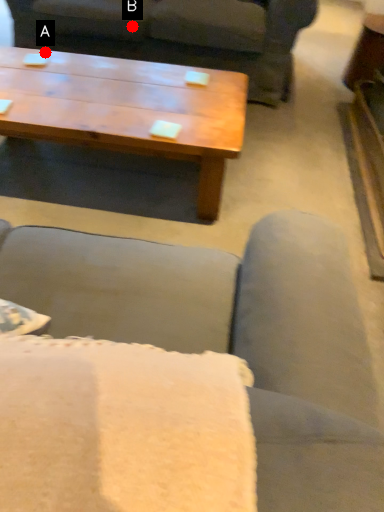
Question: Two points are circled on the image, labeled by A and B beside each circle. Among these points, which one is nearest to the camera?

Choices:
 (A) A is closer
 (B) B is closer

Answer: (A)